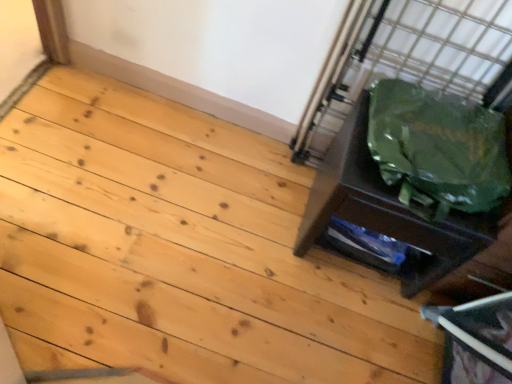
Question: Can you confirm if natural wood floor at lower right is positioned to the left of green plastic bag at right?

Choices:
 (A) yes
 (B) no

Answer: (A)

Question: From a real-world perspective, is natural wood floor at lower right located beneath green plastic bag at right?

Choices:
 (A) no
 (B) yes

Answer: (B)

Question: Could you tell me if natural wood floor at lower right is facing green plastic bag at right?

Choices:
 (A) yes
 (B) no

Answer: (B)

Question: Is natural wood floor at lower right shorter than green plastic bag at right?

Choices:
 (A) no
 (B) yes

Answer: (B)

Question: Can you confirm if natural wood floor at lower right is positioned to the right of green plastic bag at right?

Choices:
 (A) yes
 (B) no

Answer: (B)

Question: From a real-world perspective, is green fabric bag at right physically located above or below green plastic bag at right?

Choices:
 (A) below
 (B) above

Answer: (A)

Question: Considering the positions of green fabric bag at right and green plastic bag at right in the image, is green fabric bag at right bigger or smaller than green plastic bag at right?

Choices:
 (A) small
 (B) big

Answer: (B)

Question: Considering the positions of point (337, 145) and point (421, 137), is point (337, 145) closer or farther from the camera than point (421, 137)?

Choices:
 (A) closer
 (B) farther

Answer: (B)

Question: From the image's perspective, is green fabric bag at right above or below green plastic bag at right?

Choices:
 (A) above
 (B) below

Answer: (B)

Question: Is point (435, 195) positioned closer to the camera than point (261, 359)?

Choices:
 (A) closer
 (B) farther

Answer: (A)

Question: Would you say green plastic bag at right is inside or outside natural wood floor at lower right?

Choices:
 (A) inside
 (B) outside

Answer: (B)

Question: Relative to natural wood floor at lower right, is green plastic bag at right in front or behind?

Choices:
 (A) front
 (B) behind

Answer: (A)

Question: In terms of size, does green plastic bag at right appear bigger or smaller than natural wood floor at lower right?

Choices:
 (A) small
 (B) big

Answer: (A)

Question: From a real-world perspective, relative to natural wood floor at lower right, is green fabric bag at right vertically above or below?

Choices:
 (A) below
 (B) above

Answer: (B)

Question: From the image's perspective, is green fabric bag at right above or below natural wood floor at lower right?

Choices:
 (A) above
 (B) below

Answer: (A)